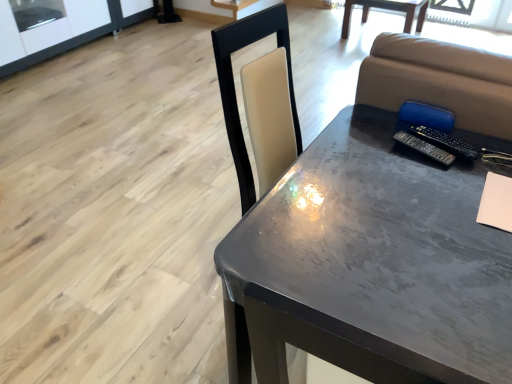
At what (x,y) coordinates should I click in order to perform the action: click on free space in front of black plastic remote at right, the 2th remote viewed from the right. Please return your answer as a coordinate pair (x, y). The width and height of the screenshot is (512, 384). Looking at the image, I should click on (433, 190).